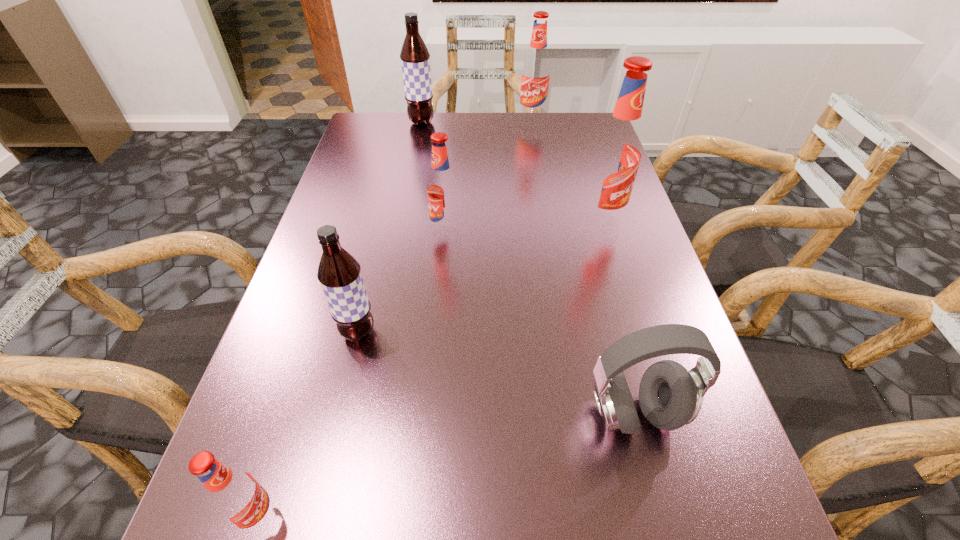
What are the coordinates of `the nearest red root beer` in the screenshot? It's located at (235, 495).

I want to click on the leftmost object, so click(x=235, y=495).

At what (x,y) coordinates should I click in order to perform the action: click on vacant space located 0.210m on the left of the rightmost root beer. Please return your answer as a coordinate pair (x, y). This screenshot has width=960, height=540. Looking at the image, I should click on (488, 221).

This screenshot has height=540, width=960. Find the location of `free space located on the front of the second red root beer from right to left`. free space located on the front of the second red root beer from right to left is located at coordinates (543, 186).

Locate an element on the screen. blank space located 0.360m on the front of the farther brown root beer is located at coordinates (406, 202).

The image size is (960, 540). Find the location of `free region located on the front of the fourth root beer from left to right`. free region located on the front of the fourth root beer from left to right is located at coordinates (440, 314).

This screenshot has height=540, width=960. Identify the location of vacant space located 0.050m on the back of the fifth farthest object. (367, 298).

Locate an element on the screen. vacant position located on the ear cups of the headset is located at coordinates (667, 538).

This screenshot has width=960, height=540. What are the coordinates of `vacant space located on the back of the nearest root beer` in the screenshot? It's located at (329, 295).

At what (x,y) coordinates should I click in order to perform the action: click on root beer located at the right edge. Please return your answer as a coordinate pair (x, y). Image resolution: width=960 pixels, height=540 pixels. Looking at the image, I should click on (616, 154).